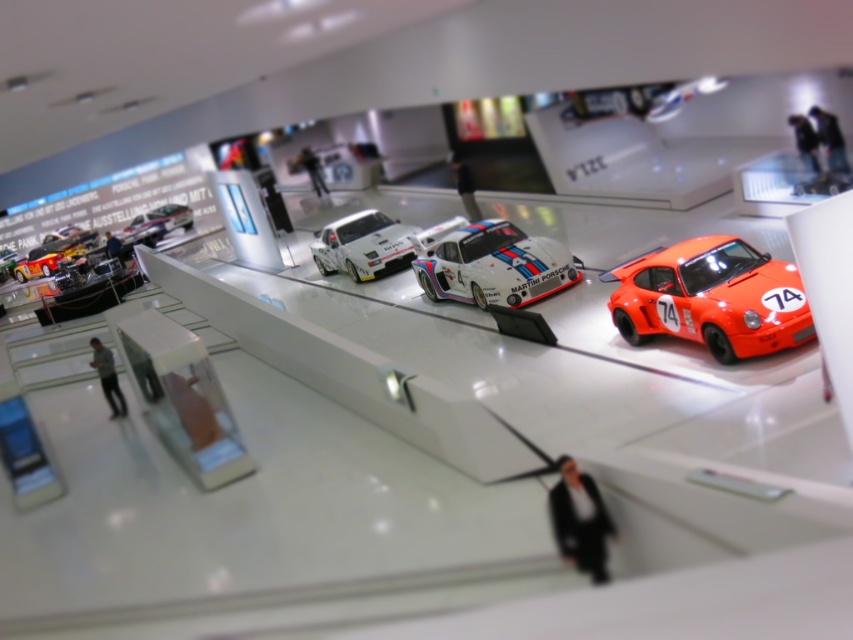
Looking at this image, you are a curator at the exhibition and want to place a new decorative item between the white glossy race car at center and the metallic silver race car at upper left. Based on their positions, where should you position the item?

The white glossy race car at center is located below the metallic silver race car at upper left, so you should place the decorative item in between them along the vertical axis.

You are a curator arranging a car exhibition. You have an orange matte toy car at right and a white glossy race car at center. Which car is closer to the visitors entering the exhibition from the front?

The orange matte toy car at right is closer to the visitors entering the front because it is positioned in front of the white glossy race car at center.

You are a security guard at the exhibition and need to ensure that all displayed items are within a 30 feet safety zone. Given the white glossy toy car at center and the metallic silver race car at upper left, are they within the safety zone?

The distance between the white glossy toy car at center and the metallic silver race car at upper left is 28.49 feet, which is within the 30 feet safety zone requirement.